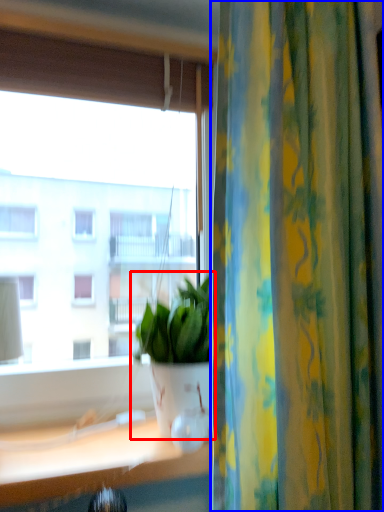
Question: Which of the following is the closest to the observer, houseplant (highlighted by a red box) or curtain (highlighted by a blue box)?

Choices:
 (A) houseplant
 (B) curtain

Answer: (B)